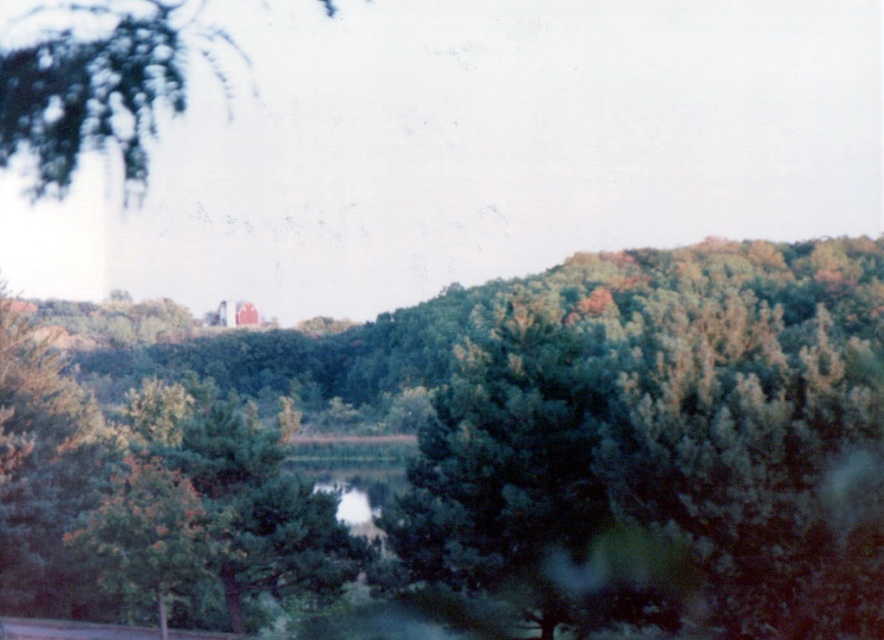
Question: Among these points, which one is nearest to the camera?

Choices:
 (A) (77, 90)
 (B) (652, 285)

Answer: (A)

Question: Does green leafy forest at center have a smaller size compared to green leafy tree at upper left?

Choices:
 (A) no
 (B) yes

Answer: (B)

Question: Among these objects, which one is nearest to the camera?

Choices:
 (A) green leafy tree at upper left
 (B) green leafy forest at center

Answer: (A)

Question: Is the position of green leafy forest at center more distant than that of green leafy tree at upper left?

Choices:
 (A) no
 (B) yes

Answer: (B)

Question: Is green leafy forest at center positioned before green leafy tree at upper left?

Choices:
 (A) yes
 (B) no

Answer: (B)